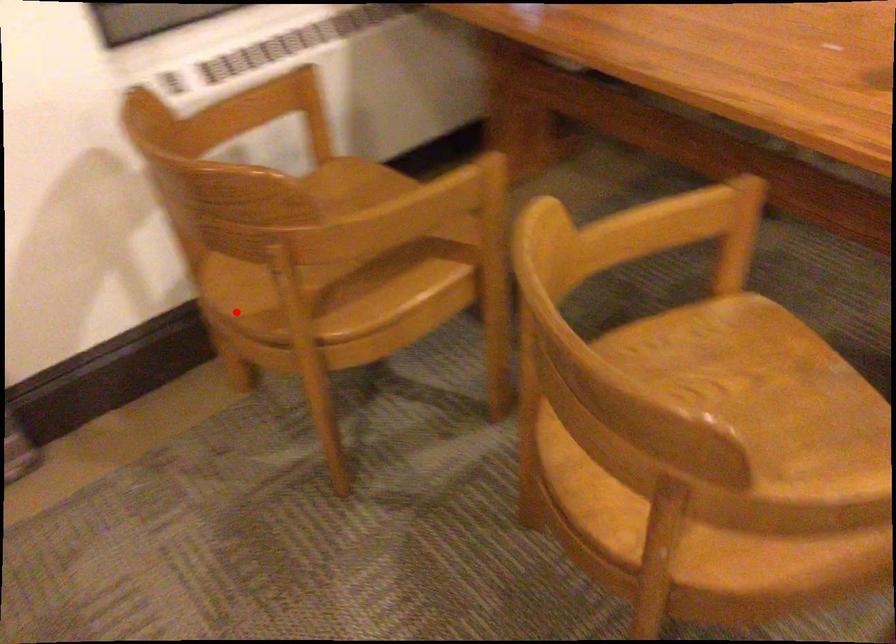
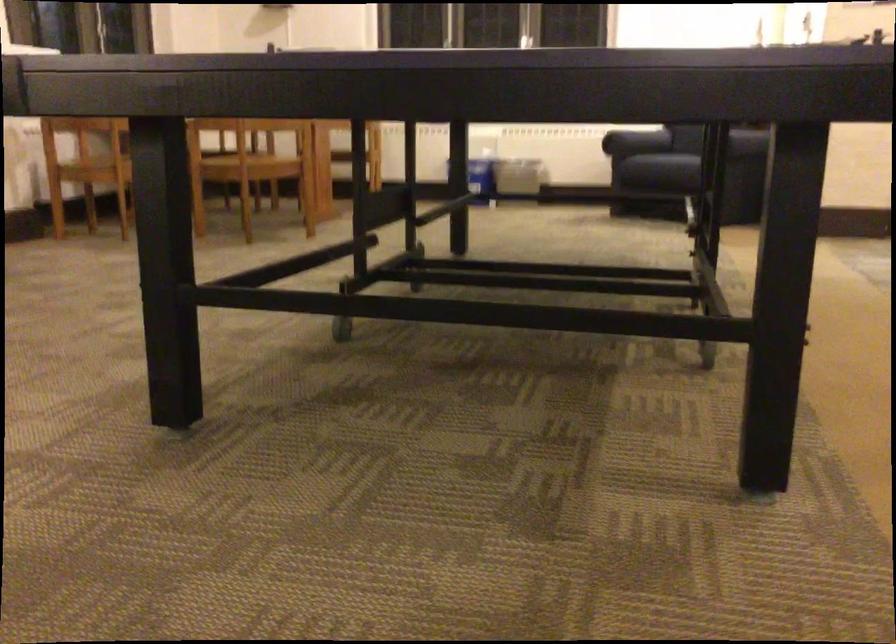
In the second image, find the point that corresponds to the highlighted location in the first image.

(95, 169)